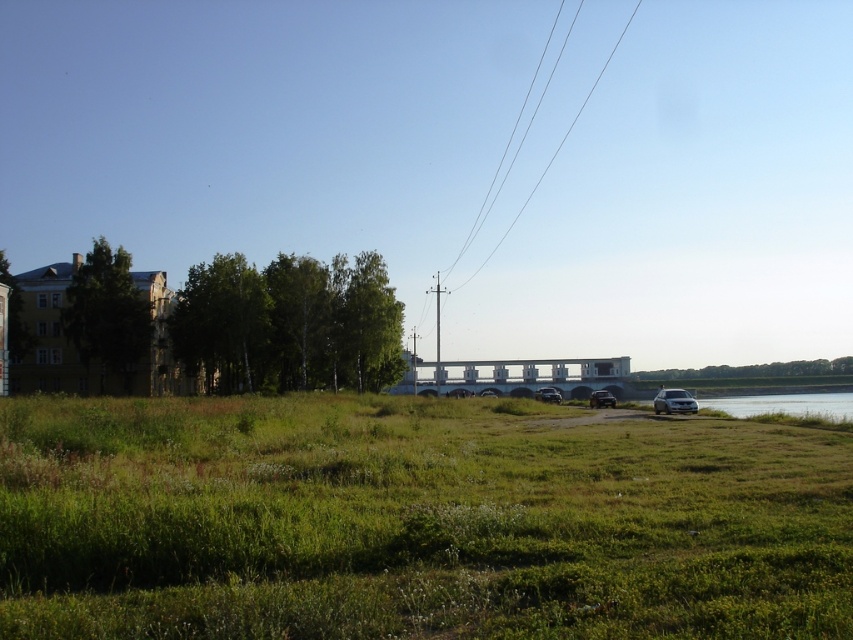
You are a photographer planning to capture a wide landscape shot that includes both the green grassy field at lower center and the satin silver suv at lower right. Given the camera you are using has a fixed focal length that can only accommodate objects of equal width, will you need to adjust your position or equipment to ensure both objects fit within the frame?

The green grassy field at lower center is wider than the satin silver suv at lower right. Since the camera requires objects of equal width to fit, you will need to adjust your position or equipment to ensure both fit within the frame.

You are a photographer planning to capture the clear wire at upper center and the satin silver suv at lower right in a single frame. Considering their relative heights, which object will appear taller in your photograph?

The clear wire at upper center will appear taller in the photograph since it has a greater height compared to the satin silver suv at lower right according to the description.

You are a photographer planning to take a photo of the satin silver suv at lower right without any obstructions. Is there a clear wire at upper center in the way that you need to be aware of?

Yes, the clear wire at upper center is located above the satin silver suv at lower right, so it may obstruct the photo unless adjusted.